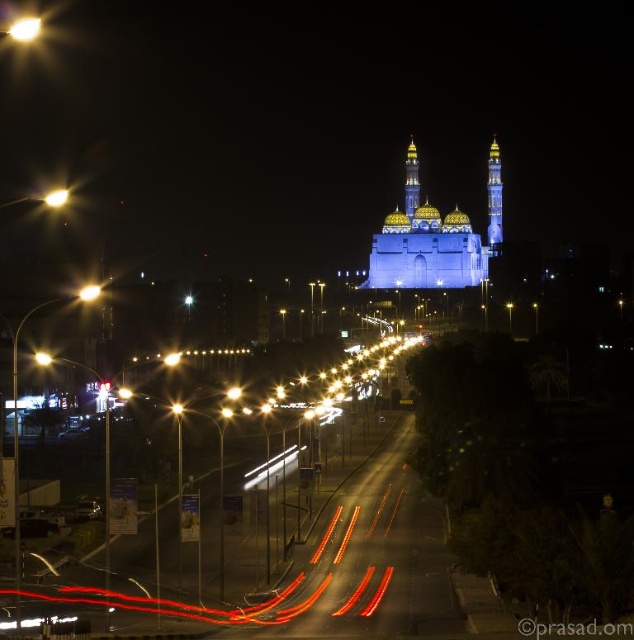
Question: Based on their relative distances, which object is nearer to the matte glass traffic light at left?

Choices:
 (A) blue glass minaret at upper center
 (B) blue illuminated mosque at center
 (C) yellow metallic streetlight at upper left

Answer: (C)

Question: Which object appears farthest from the camera in this image?

Choices:
 (A) bright yellow streetlight at center
 (B) metallic streetlight at upper left
 (C) matte glass traffic light at left
 (D) blue illuminated mosque at center

Answer: (D)

Question: Does blue glass minaret at upper center appear over metallic streetlight at upper left?

Choices:
 (A) yes
 (B) no

Answer: (B)

Question: Which of the following is the closest to the observer?

Choices:
 (A) bright yellow streetlight at center
 (B) matte glass traffic light at left

Answer: (A)

Question: Does metallic streetlight at left appear under matte glass traffic light at left?

Choices:
 (A) no
 (B) yes

Answer: (A)

Question: Does blue glass minaret at upper center have a greater width compared to bright yellow streetlight at center?

Choices:
 (A) yes
 (B) no

Answer: (A)